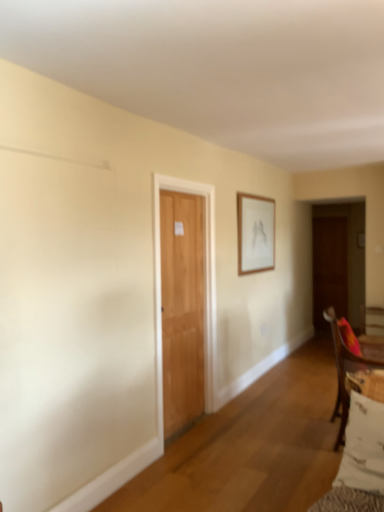
Question: From the image's perspective, is brown wooden door at right, the second door viewed from the front, on top of wooden chair at lower right?

Choices:
 (A) no
 (B) yes

Answer: (B)

Question: From a real-world perspective, is brown wooden door at right, the first door positioned from the back, under wooden chair at lower right?

Choices:
 (A) no
 (B) yes

Answer: (A)

Question: Does brown wooden door at right, which ranks as the 2th door in left-to-right order, lie behind wooden chair at lower right?

Choices:
 (A) yes
 (B) no

Answer: (A)

Question: From a real-world perspective, is brown wooden door at right, which ranks as the 2th door in left-to-right order, on wooden chair at lower right?

Choices:
 (A) yes
 (B) no

Answer: (A)

Question: Does brown wooden door at right, which ranks as the 2th door in left-to-right order, contain wooden chair at lower right?

Choices:
 (A) yes
 (B) no

Answer: (B)

Question: Does point [x=162, y=373] appear closer or farther from the camera than point [x=347, y=428]?

Choices:
 (A) closer
 (B) farther

Answer: (B)

Question: From the image's perspective, is light brown wooden door at center, positioned as the 1th door in left-to-right order, located above or below white cotton pillow at lower right?

Choices:
 (A) below
 (B) above

Answer: (B)

Question: Is light brown wooden door at center, which is the second door from back to front, to the left or to the right of white cotton pillow at lower right in the image?

Choices:
 (A) right
 (B) left

Answer: (B)

Question: In the image, is light brown wooden door at center, marked as the second door in a right-to-left arrangement, positioned in front of or behind white cotton pillow at lower right?

Choices:
 (A) front
 (B) behind

Answer: (B)

Question: Visually, is brown wooden door at right, which ranks as the 2th door in left-to-right order, positioned to the left or to the right of white cotton pillow at lower right?

Choices:
 (A) left
 (B) right

Answer: (B)

Question: Is brown wooden door at right, the second door viewed from the front, in front of or behind white cotton pillow at lower right in the image?

Choices:
 (A) behind
 (B) front

Answer: (A)

Question: From a real-world perspective, is brown wooden door at right, the first door positioned from the back, physically located above or below white cotton pillow at lower right?

Choices:
 (A) below
 (B) above

Answer: (B)

Question: From the image's perspective, is brown wooden door at right, which ranks as the 2th door in left-to-right order, positioned above or below white cotton pillow at lower right?

Choices:
 (A) above
 (B) below

Answer: (A)

Question: Would you say wooden chair at lower right is to the left or to the right of brown wooden door at right, which ranks as the 2th door in left-to-right order, in the picture?

Choices:
 (A) right
 (B) left

Answer: (B)

Question: From a real-world perspective, is wooden chair at lower right above or below brown wooden door at right, the first door positioned from the back?

Choices:
 (A) above
 (B) below

Answer: (B)